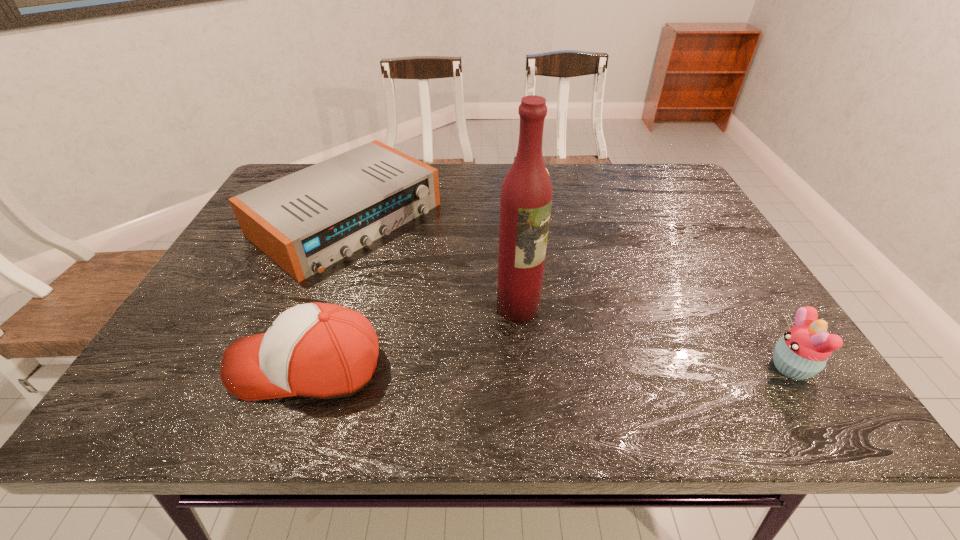
The width and height of the screenshot is (960, 540). Find the location of `baseball cap`. baseball cap is located at coordinates (318, 350).

Where is `cupcake`? Image resolution: width=960 pixels, height=540 pixels. cupcake is located at coordinates (802, 352).

The width and height of the screenshot is (960, 540). In order to click on radio receiver in this screenshot , I will do `click(306, 221)`.

Locate an element on the screen. duck is located at coordinates (545, 167).

Locate an element on the screen. The height and width of the screenshot is (540, 960). the tallest object is located at coordinates (526, 195).

Identify the location of liquor. The height and width of the screenshot is (540, 960). (526, 195).

Identify the location of vacant space located 0.100m on the front-facing side of the baseball cap. (182, 366).

Where is `free space located 0.100m on the front-facing side of the baseball cap`? free space located 0.100m on the front-facing side of the baseball cap is located at coordinates (182, 366).

Identify the location of vacant space located 0.120m on the front-facing side of the baseball cap. (173, 366).

Locate an element on the screen. Image resolution: width=960 pixels, height=540 pixels. free region located on the face of the rightmost object is located at coordinates (652, 367).